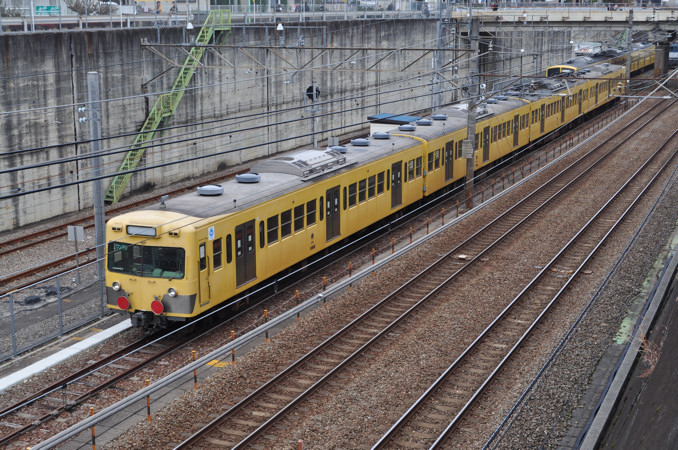
The image size is (678, 450). Identify the location of staircase. (156, 112).